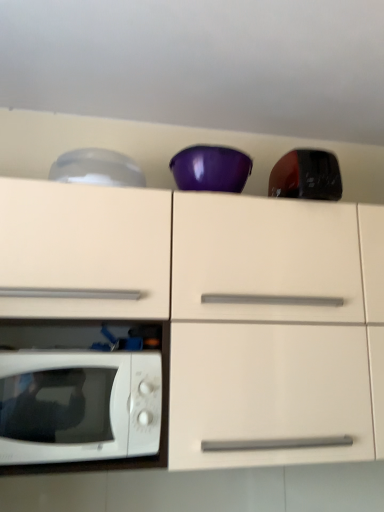
Question: Considering the relative sizes of white glossy microwave oven at lower left and white glossy cabinet at center in the image provided, is white glossy microwave oven at lower left shorter than white glossy cabinet at center?

Choices:
 (A) yes
 (B) no

Answer: (A)

Question: Would you say white glossy microwave oven at lower left is outside white glossy cabinet at center?

Choices:
 (A) yes
 (B) no

Answer: (B)

Question: Is white glossy microwave oven at lower left with white glossy cabinet at center?

Choices:
 (A) yes
 (B) no

Answer: (B)

Question: Can you confirm if white glossy microwave oven at lower left is positioned to the left of white glossy cabinet at center?

Choices:
 (A) no
 (B) yes

Answer: (B)

Question: Is white glossy microwave oven at lower left smaller than white glossy cabinet at center?

Choices:
 (A) yes
 (B) no

Answer: (A)

Question: From a real-world perspective, is transparent plastic bowl at upper left, the 2th appliance viewed from the right, positioned above or below glossy black toaster at upper right, arranged as the 2th appliance when viewed from the left?

Choices:
 (A) below
 (B) above

Answer: (B)

Question: Considering the positions of transparent plastic bowl at upper left, the 2th appliance viewed from the right, and glossy black toaster at upper right, arranged as the 2th appliance when viewed from the left, in the image, is transparent plastic bowl at upper left, the 2th appliance viewed from the right, taller or shorter than glossy black toaster at upper right, arranged as the 2th appliance when viewed from the left,?

Choices:
 (A) tall
 (B) short

Answer: (B)

Question: Looking at the image, does transparent plastic bowl at upper left, the 2th appliance viewed from the right, seem bigger or smaller compared to glossy black toaster at upper right, arranged as the 2th appliance when viewed from the left?

Choices:
 (A) small
 (B) big

Answer: (A)

Question: In terms of width, does transparent plastic bowl at upper left, the 2th appliance viewed from the right, look wider or thinner when compared to glossy black toaster at upper right, arranged as the first appliance when viewed from the right?

Choices:
 (A) thin
 (B) wide

Answer: (A)

Question: From the image's perspective, relative to white glossy cabinet at center, is transparent plastic bowl at upper left, the 2th appliance viewed from the right, above or below?

Choices:
 (A) below
 (B) above

Answer: (B)

Question: Looking at their shapes, would you say transparent plastic bowl at upper left, the 2th appliance viewed from the right, is wider or thinner than white glossy cabinet at center?

Choices:
 (A) wide
 (B) thin

Answer: (B)

Question: From a real-world perspective, is transparent plastic bowl at upper left, positioned as the 1th appliance in left-to-right order, above or below white glossy cabinet at center?

Choices:
 (A) above
 (B) below

Answer: (A)

Question: Is point (91, 151) positioned closer to the camera than point (66, 374)?

Choices:
 (A) closer
 (B) farther

Answer: (B)

Question: Is glossy black toaster at upper right, arranged as the 2th appliance when viewed from the left, wider or thinner than transparent plastic bowl at upper left, positioned as the 1th appliance in left-to-right order?

Choices:
 (A) wide
 (B) thin

Answer: (A)

Question: Is glossy black toaster at upper right, arranged as the 2th appliance when viewed from the left, taller or shorter than transparent plastic bowl at upper left, positioned as the 1th appliance in left-to-right order?

Choices:
 (A) tall
 (B) short

Answer: (A)